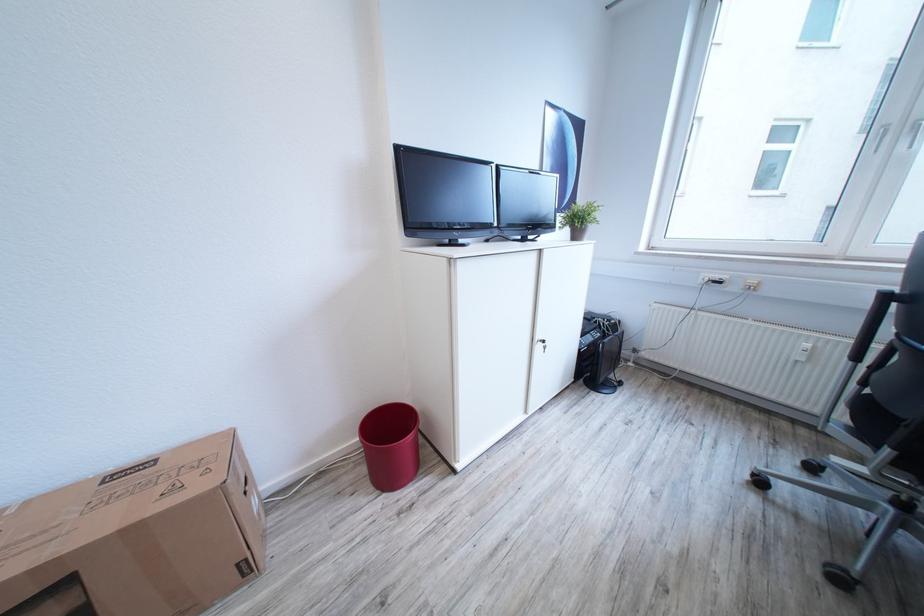
This screenshot has height=616, width=924. Describe the element at coordinates (865, 334) in the screenshot. I see `the black chair armrest` at that location.